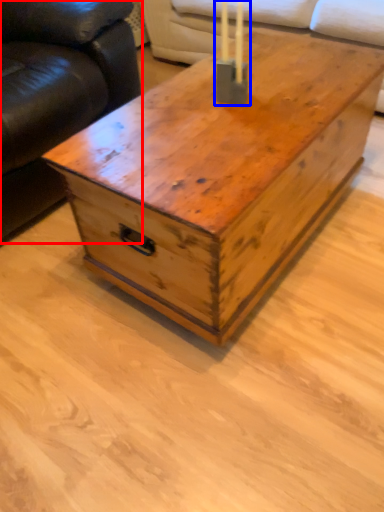
Question: Which object appears closest to the camera in this image, studio couch (highlighted by a red box) or candle holder (highlighted by a blue box)?

Choices:
 (A) studio couch
 (B) candle holder

Answer: (A)